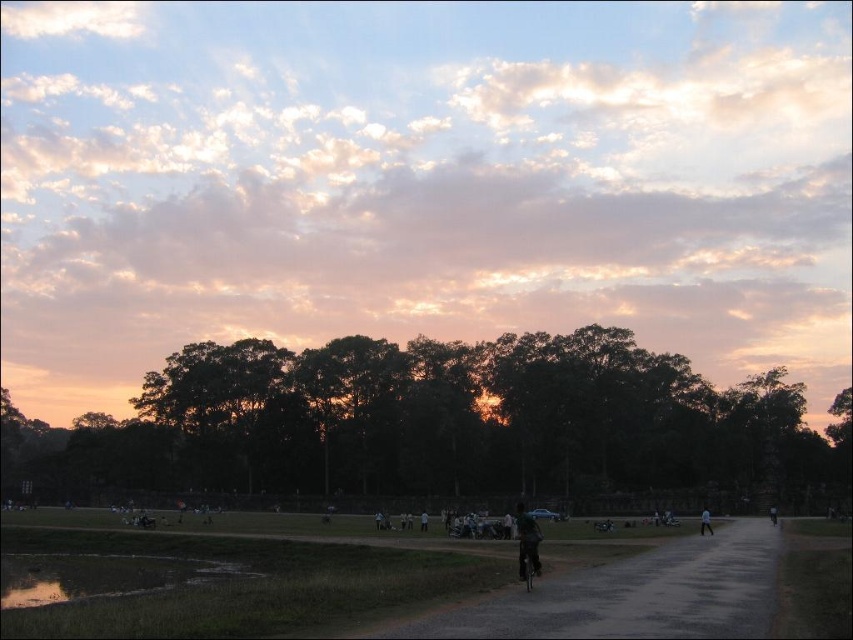
Question: Does dark green leafy trees at center have a lesser width compared to dark blue jeans at center?

Choices:
 (A) yes
 (B) no

Answer: (B)

Question: Based on their relative distances, which object is nearer to the dark asphalt road at center?

Choices:
 (A) dark blue jeans at center
 (B) white matte person at center
 (C) black matte bicycle at center
 (D) pink fluffy clouds at upper center

Answer: (A)

Question: Is dark blue jeans at center thinner than white matte person at center?

Choices:
 (A) yes
 (B) no

Answer: (A)

Question: Observing the image, what is the correct spatial positioning of pink fluffy clouds at upper center in reference to dark blue jeans at center?

Choices:
 (A) below
 (B) above

Answer: (B)

Question: Which is nearer to the white matte person at center?

Choices:
 (A) dark blue jeans at center
 (B) pink fluffy clouds at upper center
 (C) dark green leafy trees at center
 (D) dark asphalt road at center

Answer: (A)

Question: Estimate the real-world distances between objects in this image. Which object is farther from the black matte bicycle at center?

Choices:
 (A) dark blue jeans at center
 (B) dark asphalt road at center
 (C) dark green leafy trees at center
 (D) pink fluffy clouds at upper center

Answer: (D)